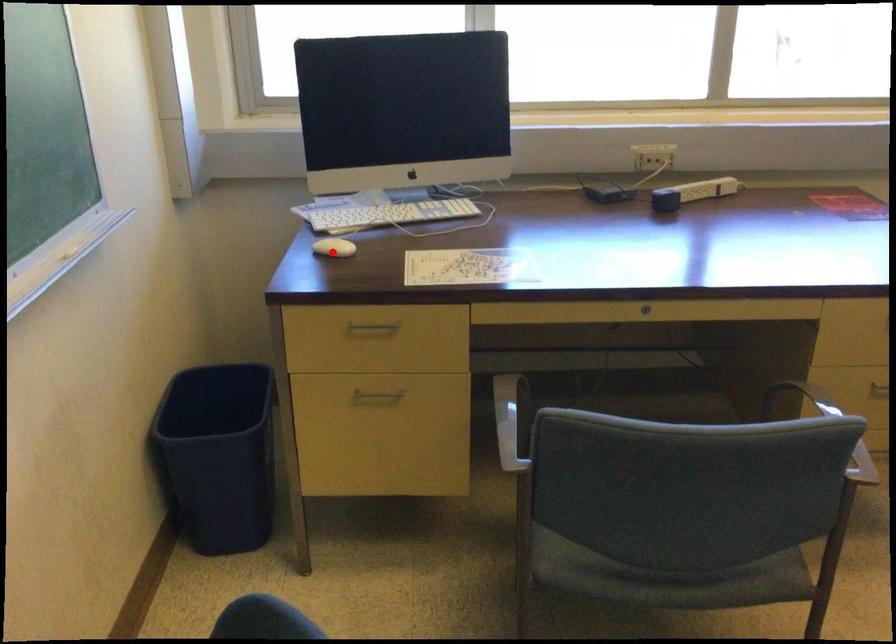
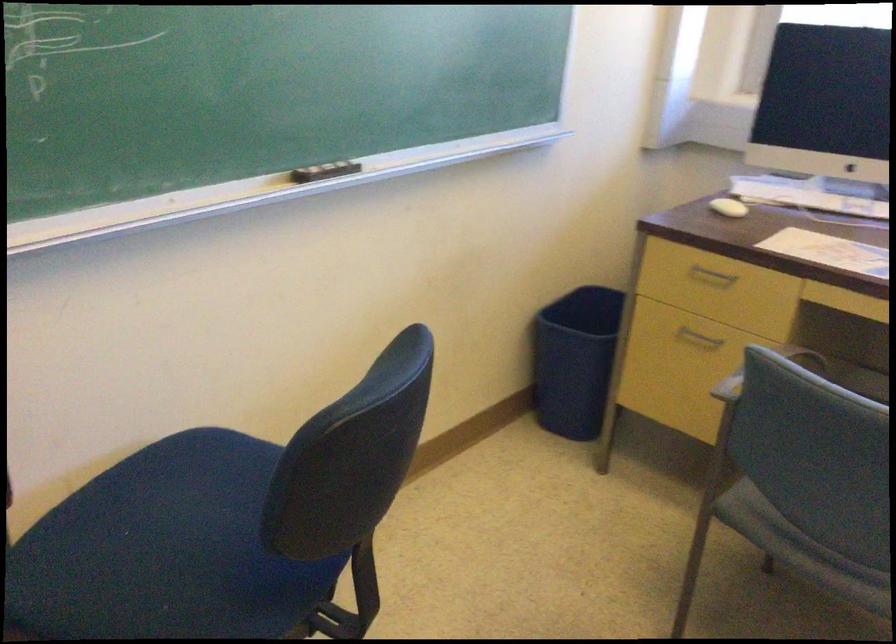
In the second image, find the point that corresponds to the highlighted location in the first image.

(728, 207)